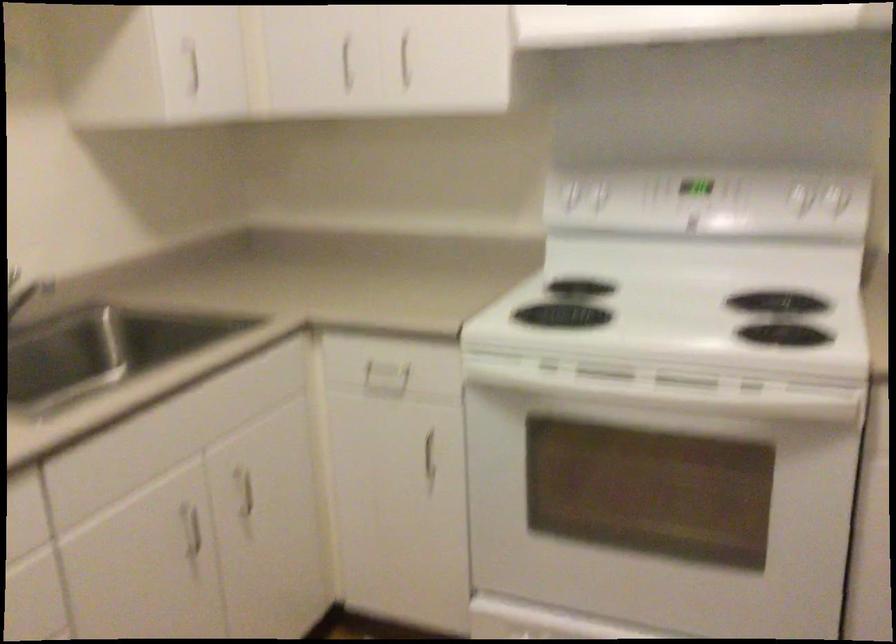
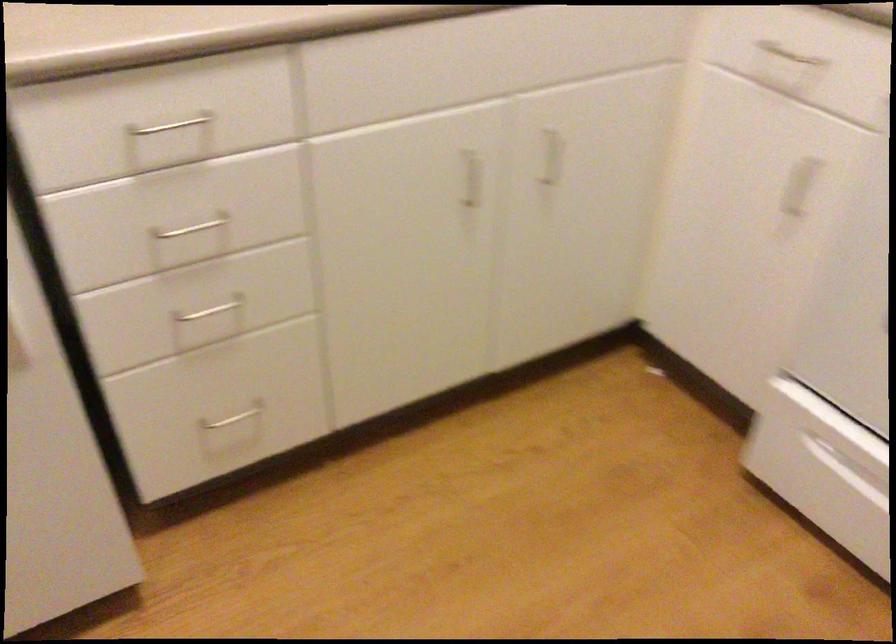
The point at (242, 489) is marked in the first image. Where is the corresponding point in the second image?

(552, 156)